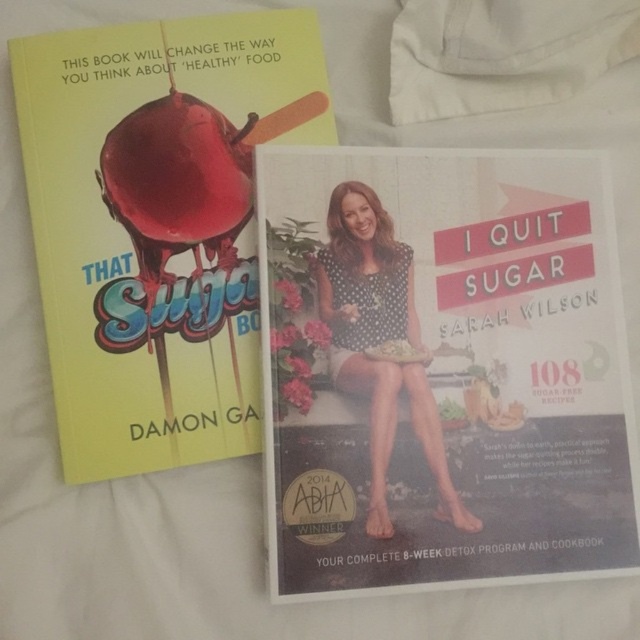
Does matte black book at lower right have a lesser height compared to polka dot fabric at center?

In fact, matte black book at lower right may be taller than polka dot fabric at center.

Image resolution: width=640 pixels, height=640 pixels. Find the location of `matte black book at lower right`. matte black book at lower right is located at coordinates (442, 369).

Which is below, matte black book at lower right or yellow matte book at upper left?

matte black book at lower right is below.

Who is more distant from viewer, (522,237) or (100,412)?

Positioned behind is point (522,237).

Where is `matte black book at lower right`? The image size is (640, 640). matte black book at lower right is located at coordinates (442, 369).

Does point (67, 33) come behind point (394, 344)?

Yes, point (67, 33) is behind point (394, 344).

Which is below, yellow matte book at upper left or polka dot fabric at center?

polka dot fabric at center

Where is `yellow matte book at upper left`? The width and height of the screenshot is (640, 640). yellow matte book at upper left is located at coordinates (157, 225).

I want to click on yellow matte book at upper left, so click(157, 225).